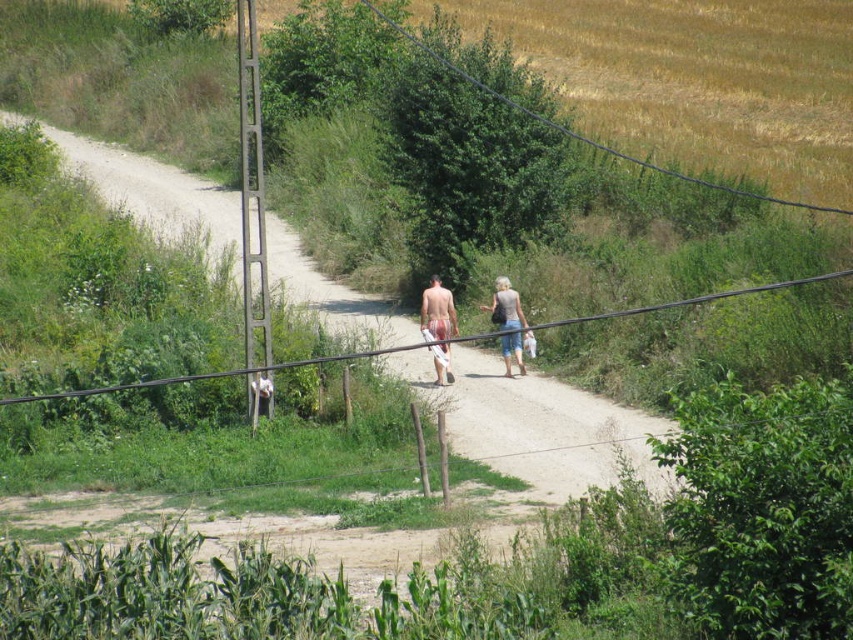
You are standing at the starting point of the dirt path in the rural scene. You notice two points marked on the path ahead. The first point is at coordinates point (374, 349) and the second point is at point (509, 304). If you were to walk towards the second point, would you pass by the first point before reaching it?

Yes, you would pass by point (374, 349) before reaching point (509, 304) because point (374, 349) is in front of point (509, 304) along the path.